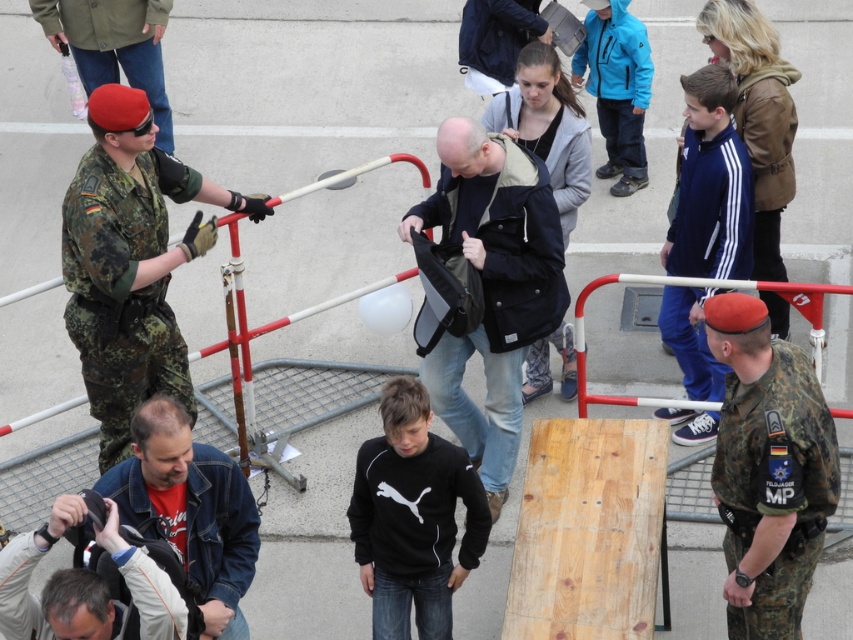
Between point (489, 452) and point (132, 12), which one is positioned in front?

Point (489, 452)

Looking at this image, who is positioned more to the left, dark blue leather jacket at center or camouflage uniform at left?

From the viewer's perspective, camouflage uniform at left appears more on the left side.

Does point (505, 358) lie behind point (152, 35)?

No, it is not.

Locate an element on the screen. dark blue leather jacket at center is located at coordinates tap(492, 285).

Does black fleece sweatshirt at center have a greater width compared to white fabric jacket at lower left?

Yes, black fleece sweatshirt at center is wider than white fabric jacket at lower left.

Does black fleece sweatshirt at center lie behind white fabric jacket at lower left?

Yes, it is.

This screenshot has width=853, height=640. What are the coordinates of `black fleece sweatshirt at center` in the screenshot? It's located at (415, 531).

Where is `black fleece sweatshirt at center`? Image resolution: width=853 pixels, height=640 pixels. black fleece sweatshirt at center is located at coordinates (415, 531).

Is point (375, 616) closer to viewer compared to point (138, 58)?

That is True.

Does black fleece sweatshirt at center have a greater height compared to camouflage uniform at left?

No, black fleece sweatshirt at center is not taller than camouflage uniform at left.

Identify the location of black fleece sweatshirt at center. The height and width of the screenshot is (640, 853). (415, 531).